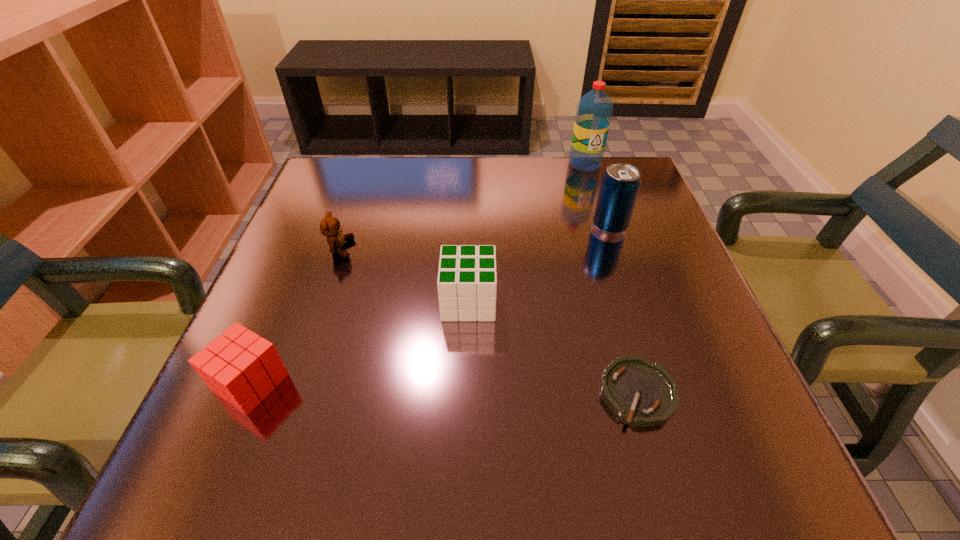
Find the location of a particular element. water bottle is located at coordinates (594, 111).

Locate an element on the screen. the farthest object is located at coordinates (594, 111).

Find the location of a particular element. The width and height of the screenshot is (960, 540). the fifth shortest object is located at coordinates (620, 184).

At what (x,y) coordinates should I click in order to perform the action: click on the taller cube. Please return your answer as a coordinate pair (x, y). Image resolution: width=960 pixels, height=540 pixels. Looking at the image, I should click on (467, 279).

Locate an element on the screen. The width and height of the screenshot is (960, 540). the right cube is located at coordinates click(467, 279).

You are a GUI agent. You are given a task and a screenshot of the screen. Output one action in this format:
    pyautogui.click(x=<x>, y=<y>)
    Task: Click on the teddy bear
    This screenshot has height=540, width=960.
    Given the screenshot: What is the action you would take?
    pyautogui.click(x=330, y=226)

Locate an element on the screen. This screenshot has height=540, width=960. the shorter cube is located at coordinates (241, 367).

Identify the location of the left cube. (241, 367).

The width and height of the screenshot is (960, 540). I want to click on ashtray, so click(x=643, y=393).

Identify the location of vacant space located 0.200m on the front label of the farthest object. (603, 222).